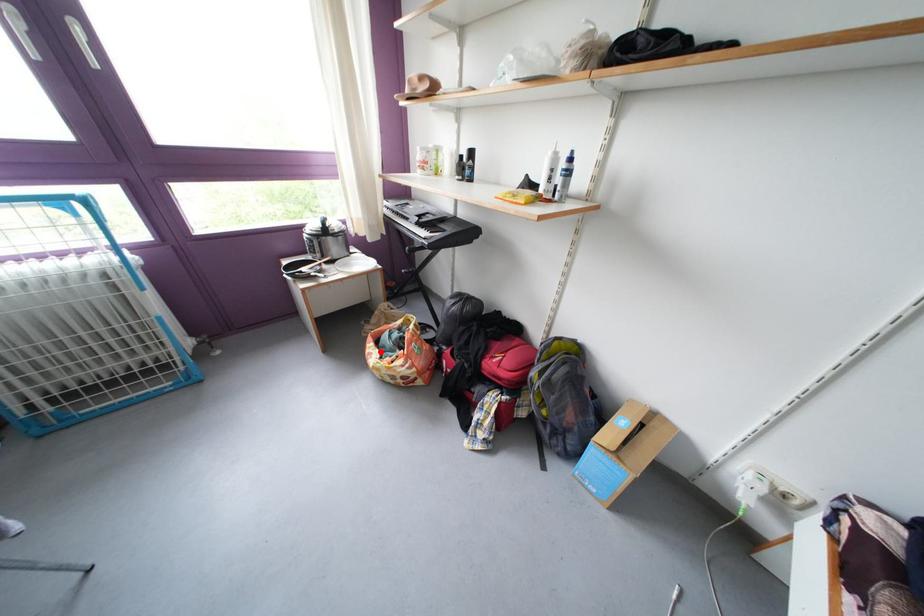
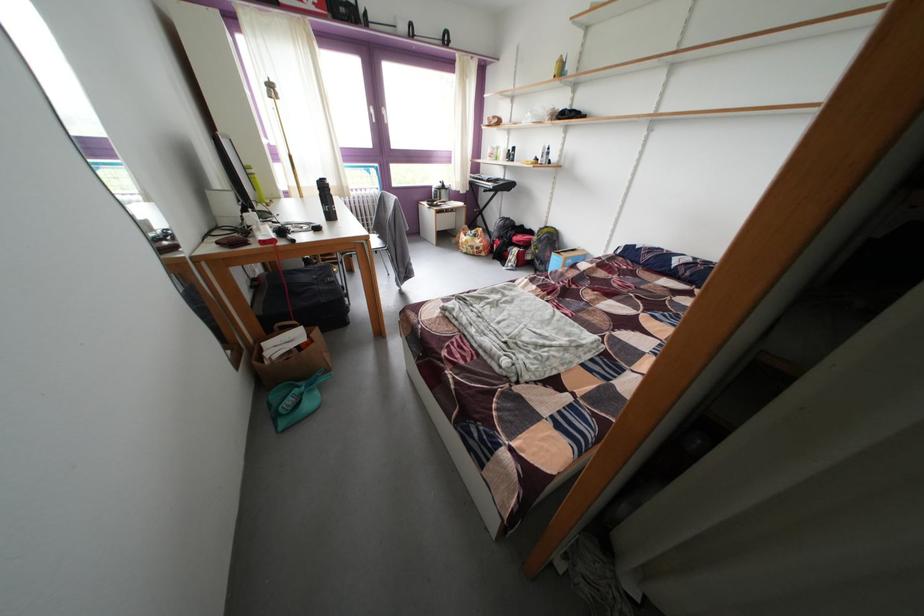
The point at the highlighted location is marked in the first image. Where is the corresponding point in the second image?

(472, 241)